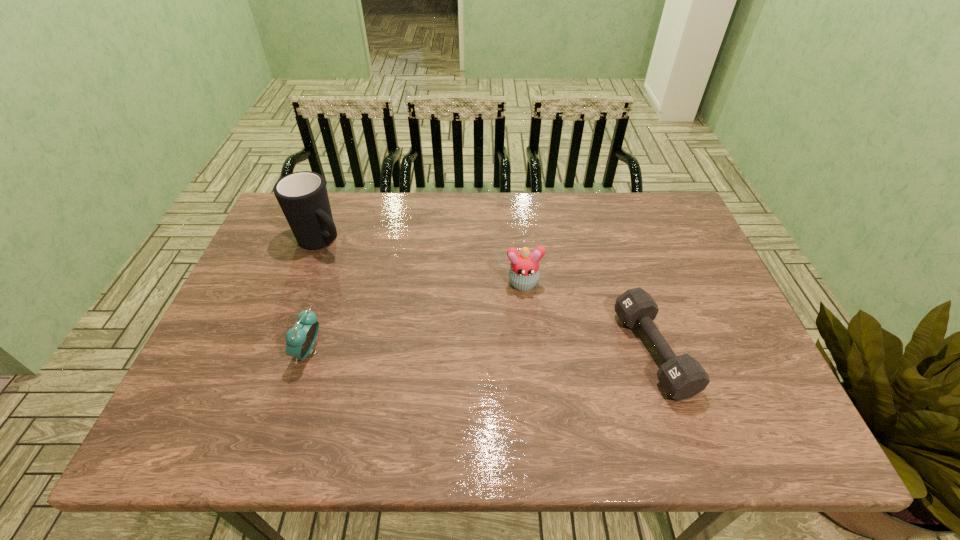
Locate an element on the screen. alarm clock is located at coordinates (300, 339).

This screenshot has height=540, width=960. Find the location of `the rightmost object`. the rightmost object is located at coordinates (682, 377).

You are a GUI agent. You are given a task and a screenshot of the screen. Output one action in this format:
    pyautogui.click(x=<x>, y=<y>)
    Task: Click on the shortest object
    
    Given the screenshot: What is the action you would take?
    pyautogui.click(x=682, y=377)

Where is `mug`? This screenshot has width=960, height=540. mug is located at coordinates click(x=302, y=196).

Find the location of a particular element. the farthest object is located at coordinates (302, 196).

Locate an element on the screen. the third object from left to right is located at coordinates (524, 273).

At what (x,y) coordinates should I click in order to perform the action: click on cupcake. Please return your answer as a coordinate pair (x, y). This screenshot has width=960, height=540. Looking at the image, I should click on (524, 273).

The height and width of the screenshot is (540, 960). In order to click on free space located on the face of the alarm clock in this screenshot , I will do `click(229, 352)`.

You are a GUI agent. You are given a task and a screenshot of the screen. Output one action in this format:
    pyautogui.click(x=<x>, y=<y>)
    Task: Click on the blank space located on the face of the alarm clock
    
    Given the screenshot: What is the action you would take?
    pyautogui.click(x=212, y=352)

The width and height of the screenshot is (960, 540). I want to click on vacant space located on the back of the dumbbell, so click(620, 250).